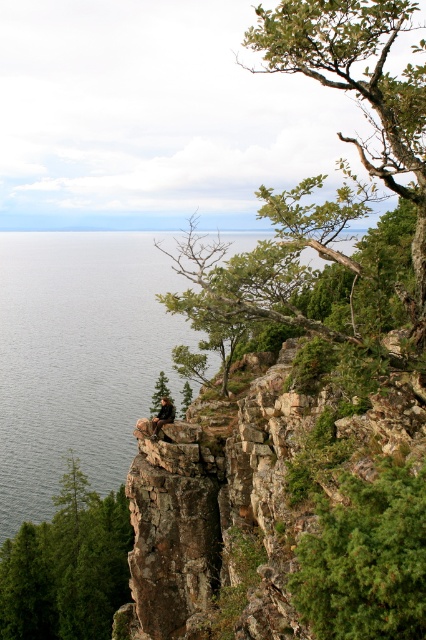
Question: Where is green leafy tree at upper right located in relation to green textured evergreen tree at center-right in the image?

Choices:
 (A) below
 (B) above

Answer: (B)

Question: Does green leafy tree at upper right have a smaller size compared to camouflage fabric person at center?

Choices:
 (A) no
 (B) yes

Answer: (A)

Question: Which of the following is the closest to the observer?

Choices:
 (A) (416, 536)
 (B) (160, 408)
 (C) (25, 456)

Answer: (A)

Question: Can you confirm if green rough bark tree at lower left is wider than green leafy tree at center?

Choices:
 (A) yes
 (B) no

Answer: (A)

Question: Among these points, which one is farthest from the camera?

Choices:
 (A) (423, 570)
 (B) (155, 392)
 (C) (183, 387)

Answer: (C)

Question: Which point is closer to the camera taking this photo?

Choices:
 (A) (163, 408)
 (B) (140, 333)

Answer: (A)